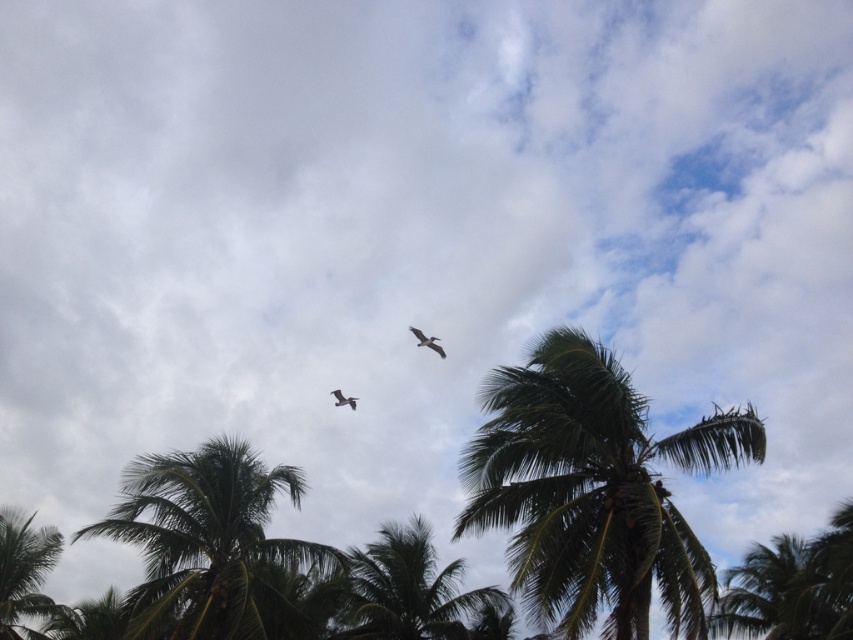
You are a drone operator tasked with capturing aerial footage of the tropical scene. You need to fly your drone from the green leafy coconut tree at center to the green leafy coconut tree at lower left. What is the approximate distance you need to cover?

The distance between the green leafy coconut tree at center and the green leafy coconut tree at lower left is approximately 119.86 meters, so you need to cover around 120 meters.